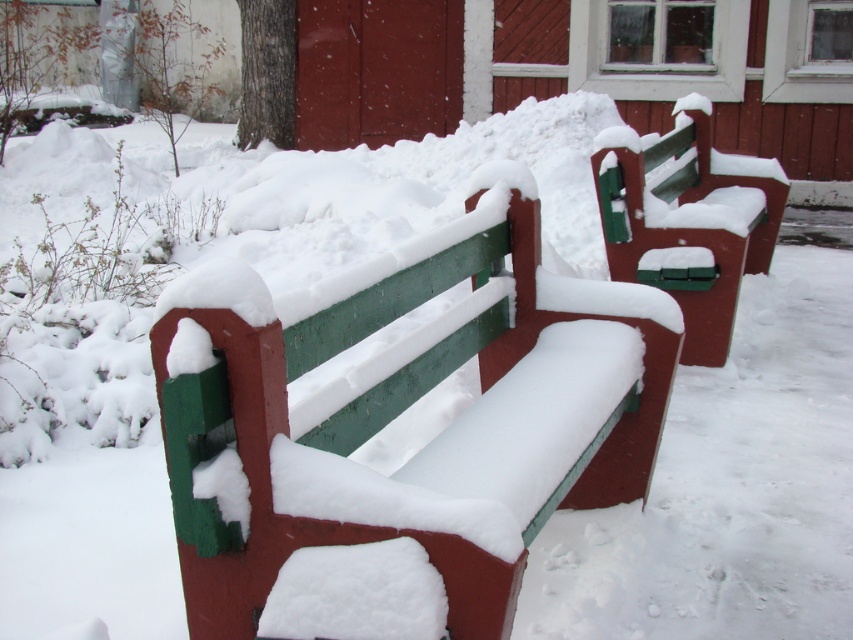
You are standing at the point marked by the coordinates point (392,419). Looking around, you see the green painted wood bench at center. Which direction should you walk to reach the red wooden building with white trim in the background?

The red wooden building with white trim is in the background behind the green painted wood bench at center. Since you are at the point representing the green painted wood bench at center, you should walk backward to reach the red wooden building with white trim.

You are a maintenance worker checking the benches in the winter scene. You notice both the green painted wood bench at center and the green matte bench at center. Which bench is located above the other?

The green painted wood bench at center is positioned under the green matte bench at center, so the green matte bench at center is above.